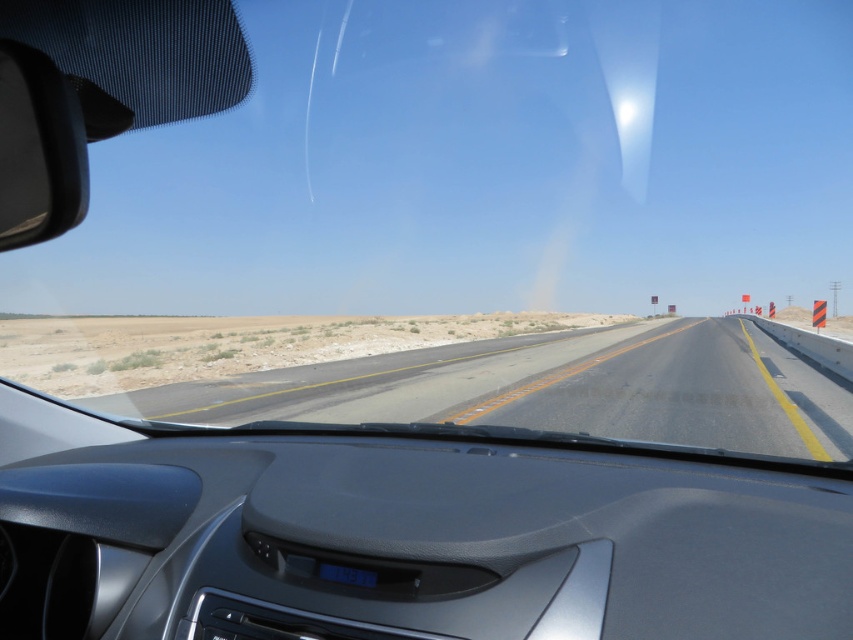
You are a driver navigating a desert highway. You notice the asphalt road at center in your view. Based on its position, can you estimate how far it is from the edge of the road?

The asphalt road at center is positioned at coordinates point [552,388], so it is approximately 0.648 units away from the edge of the road.

You are driving a car and see two points on the road ahead. The first point is at coordinates point (x=804, y=426) and the second point is at point (x=45, y=192). Which point is closer to your current position?

Point (x=45, y=192) is closer to your current position because it is in front of point (x=804, y=426), which is further back.

You are driving a car with a 10 meter long trailer attached. You want to safely navigate a section of road where there are orange and black striped traffic cones ahead. Based on the image, can your trailer fit entirely within the asphalt road at center while staying clear of the black glossy view mirror at left?

The distance between the asphalt road at center and the black glossy view mirror at left is 11.17 meters. Since the trailer is 10 meters long, it can fit within this space while maintaining a safe distance from the mirror.